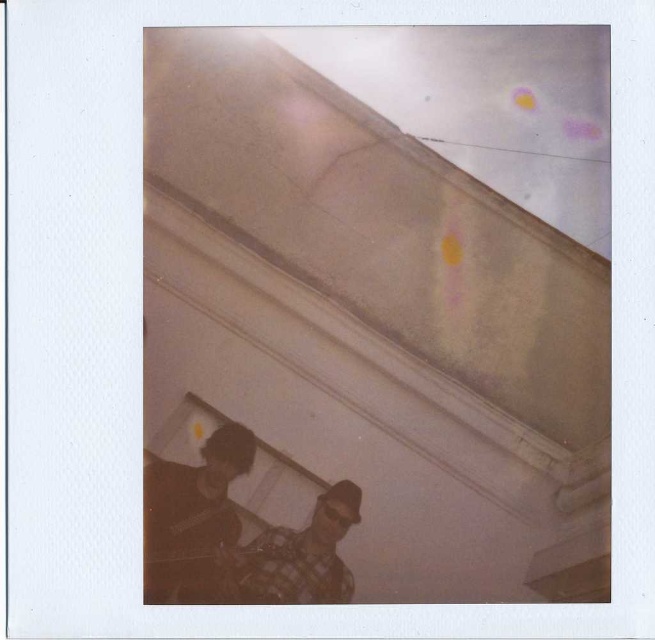
Question: Among these points, which one is farthest from the camera?

Choices:
 (A) (183, 512)
 (B) (240, 579)

Answer: (A)

Question: Can you confirm if dark brown leather jacket at lower left is positioned above checkered fabric shirt at lower center?

Choices:
 (A) yes
 (B) no

Answer: (A)

Question: Which object appears closest to the camera in this image?

Choices:
 (A) checkered fabric shirt at lower center
 (B) dark brown leather jacket at lower left

Answer: (B)

Question: Can you confirm if dark brown leather jacket at lower left is positioned to the right of checkered fabric shirt at lower center?

Choices:
 (A) no
 (B) yes

Answer: (A)

Question: Can you confirm if dark brown leather jacket at lower left is thinner than checkered fabric shirt at lower center?

Choices:
 (A) yes
 (B) no

Answer: (A)